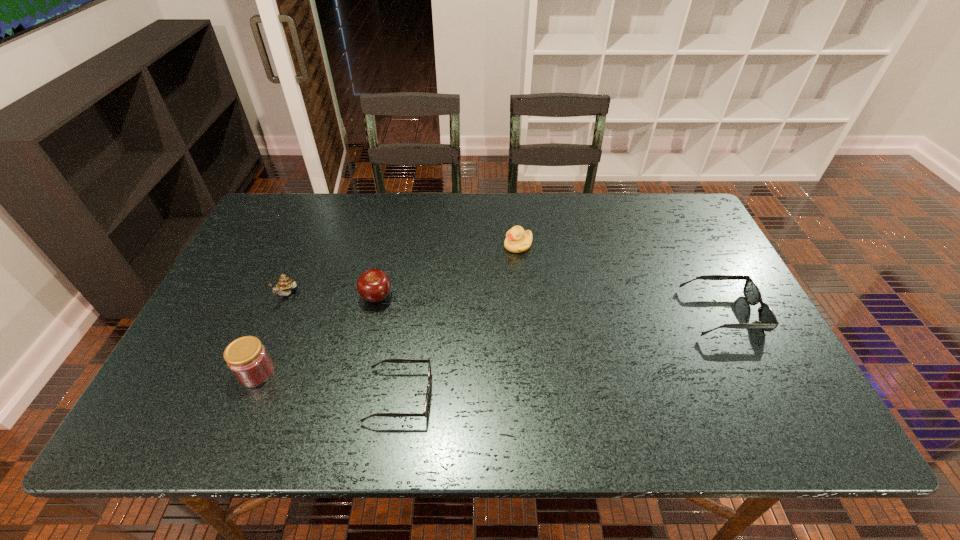
This screenshot has width=960, height=540. In order to click on vacant region located 0.190m on the right of the apple in this screenshot , I will do `click(464, 297)`.

At what (x,y) coordinates should I click in order to perform the action: click on vacant space located on the face of the snail. Please return your answer as a coordinate pair (x, y). Looking at the image, I should click on (257, 366).

Find the location of a particular element. The height and width of the screenshot is (540, 960). blank area located on the front-facing side of the farthest object is located at coordinates (381, 245).

Where is `vacant point located on the front-facing side of the farthest object`? The width and height of the screenshot is (960, 540). vacant point located on the front-facing side of the farthest object is located at coordinates (384, 245).

Identify the location of vacant space located on the front-facing side of the farthest object. (464, 245).

What are the coordinates of `free point located on the right of the jam` in the screenshot? It's located at pos(314,373).

The height and width of the screenshot is (540, 960). I want to click on object located in the far edge section of the desktop, so click(x=517, y=240).

Locate an element on the screen. Image resolution: width=960 pixels, height=540 pixels. sunglasses positioned at the near edge is located at coordinates click(427, 400).

Where is `jam located in the near edge section of the desktop`? The width and height of the screenshot is (960, 540). jam located in the near edge section of the desktop is located at coordinates (247, 358).

I want to click on snail that is positioned at the left edge, so click(x=285, y=284).